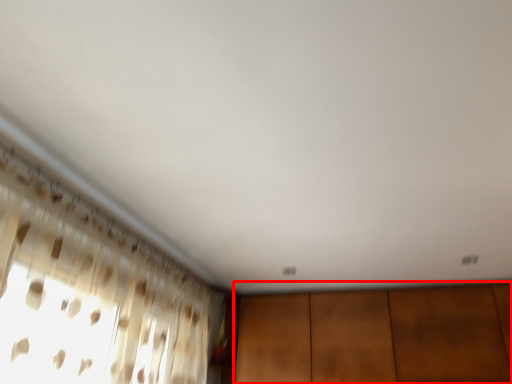
Question: Considering the relative positions of dresser (annotated by the red box) and curtain in the image provided, where is dresser (annotated by the red box) located with respect to the staircase?

Choices:
 (A) left
 (B) right

Answer: (B)